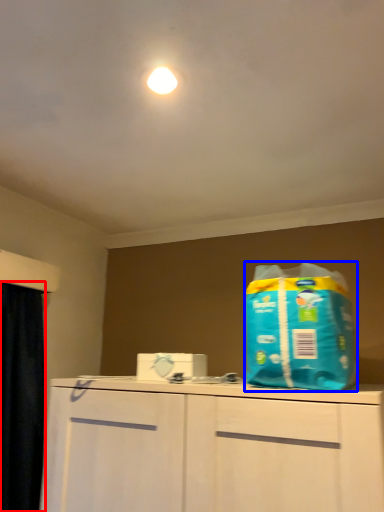
Question: Which of the following is the farthest to the observer, curtain (highlighted by a red box) or cleaning product (highlighted by a blue box)?

Choices:
 (A) curtain
 (B) cleaning product

Answer: (A)